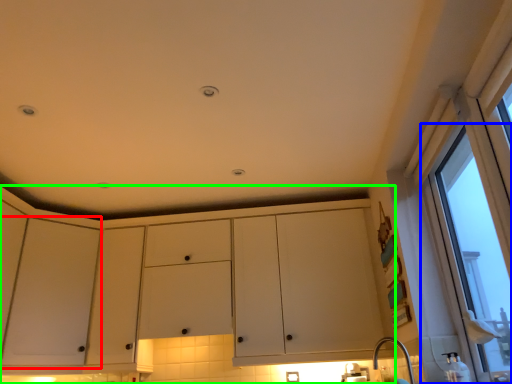
Question: Which object is the closest to the screen door (highlighted by a red box)? Choose among these: window (highlighted by a blue box) or cabinetry (highlighted by a green box).

Choices:
 (A) window
 (B) cabinetry

Answer: (B)